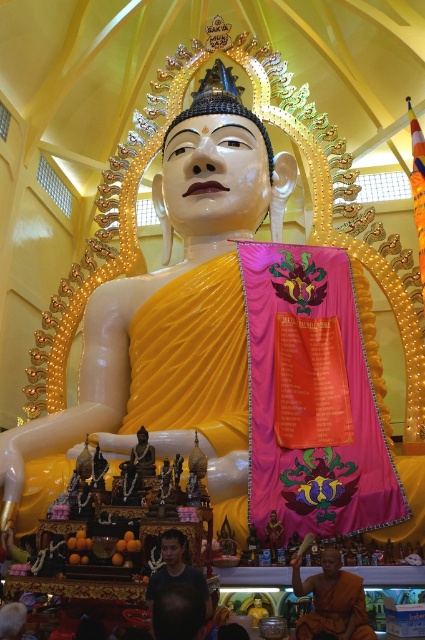
Question: Which object is farther from the camera taking this photo?

Choices:
 (A) dark blue shirt at lower center
 (B) brown cloth monk at lower center

Answer: (A)

Question: Can you confirm if brown cloth monk at lower center is smaller than dark blue shirt at lower center?

Choices:
 (A) yes
 (B) no

Answer: (B)

Question: Does brown cloth monk at lower center have a lesser width compared to dark blue shirt at lower center?

Choices:
 (A) no
 (B) yes

Answer: (A)

Question: Where is brown cloth monk at lower center located in relation to dark blue shirt at lower center in the image?

Choices:
 (A) below
 (B) above

Answer: (A)

Question: Among these points, which one is farthest from the camera?

Choices:
 (A) (337, 580)
 (B) (153, 579)

Answer: (A)